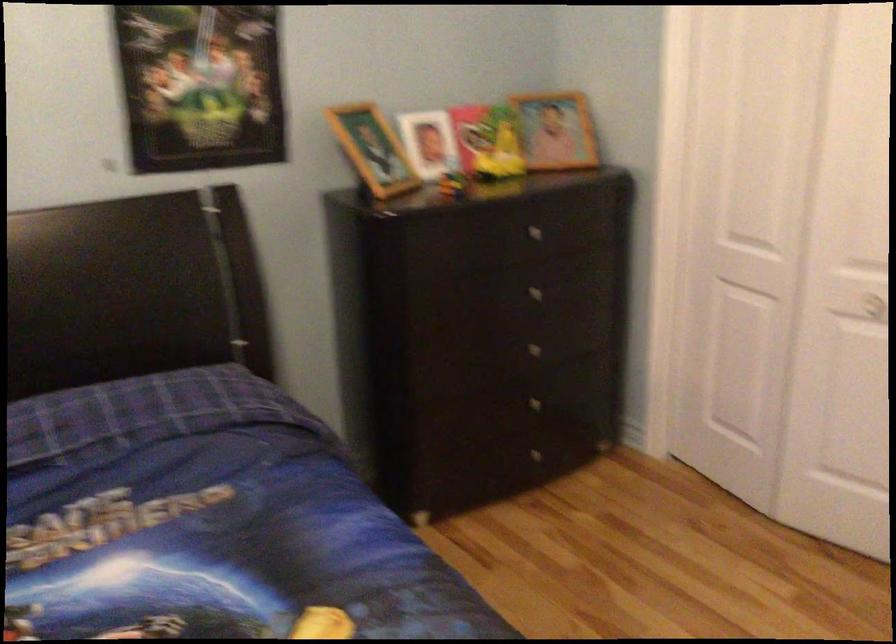
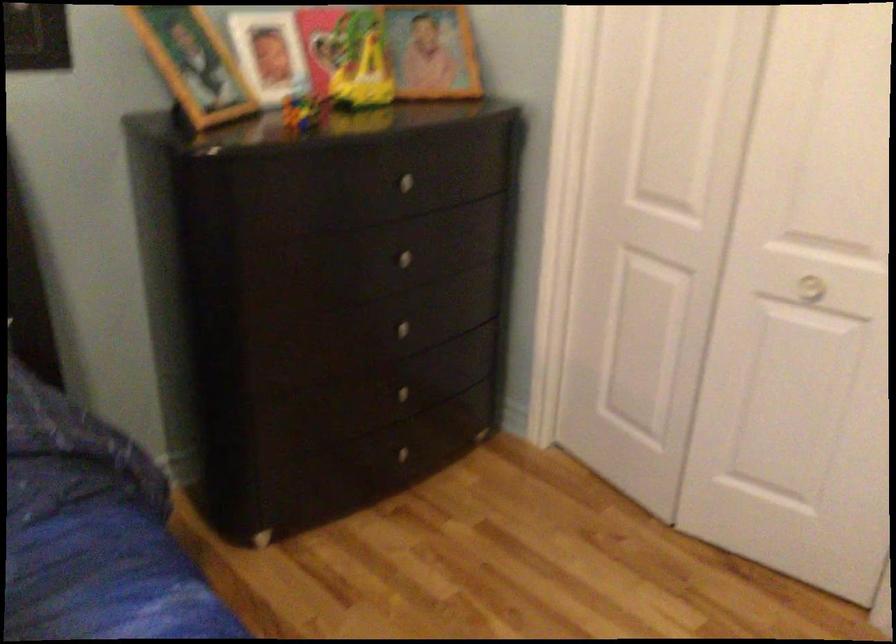
Locate, in the second image, the point that corresponds to point (533, 404) in the first image.

(400, 393)